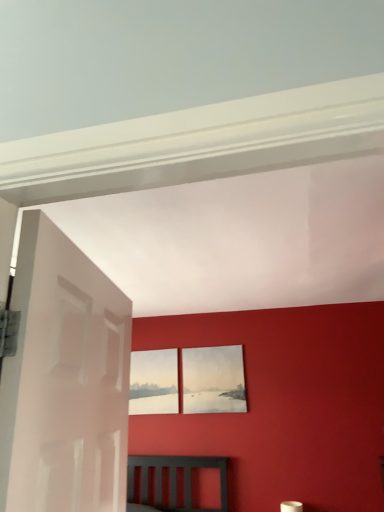
Question: From the image's perspective, is matte paper picture frame at center, which appears as the 2th picture frame when viewed from the left, above or below white glossy door at left?

Choices:
 (A) above
 (B) below

Answer: (B)

Question: Looking at their shapes, would you say matte paper picture frame at center, which appears as the 2th picture frame when viewed from the left, is wider or thinner than white glossy door at left?

Choices:
 (A) wide
 (B) thin

Answer: (B)

Question: Estimate the real-world distances between objects in this image. Which object is closer to the white glossy door at left?

Choices:
 (A) matte white picture frame at center, the 2th picture frame from the right
 (B) matte paper picture frame at center, which appears as the 2th picture frame when viewed from the left

Answer: (B)

Question: Which object is positioned closest to the matte white picture frame at center, the 2th picture frame from the right?

Choices:
 (A) matte paper picture frame at center, which appears as the 2th picture frame when viewed from the left
 (B) white glossy door at left

Answer: (A)